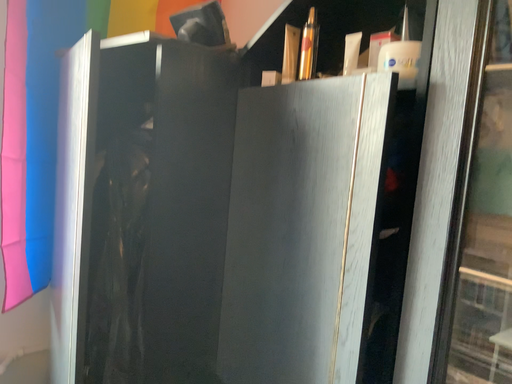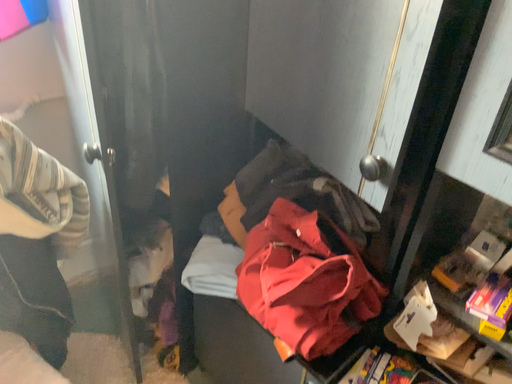
Question: Which way did the camera rotate in the video?

Choices:
 (A) rotated upward
 (B) rotated downward

Answer: (B)